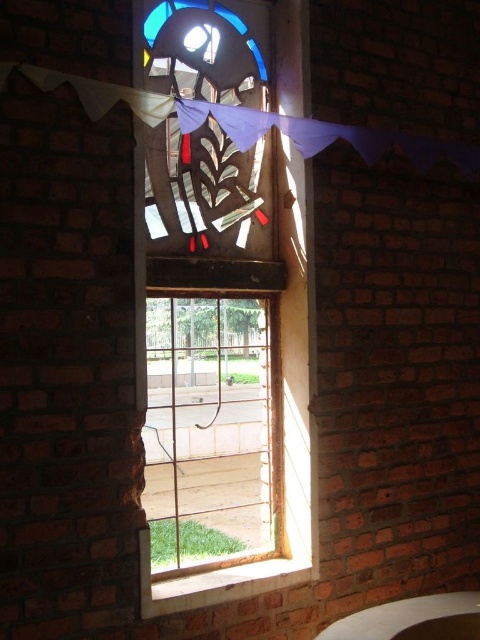
Question: Is stained glass window at center positioned in front of clear glass window at center?

Choices:
 (A) no
 (B) yes

Answer: (B)

Question: Which point is closer to the camera?

Choices:
 (A) (248, 504)
 (B) (210, 554)

Answer: (A)

Question: Among these objects, which one is farthest from the camera?

Choices:
 (A) stained glass window at center
 (B) clear glass window at center

Answer: (B)

Question: Can you confirm if stained glass window at center is thinner than clear glass window at center?

Choices:
 (A) yes
 (B) no

Answer: (B)

Question: Is stained glass window at center behind clear glass window at center?

Choices:
 (A) no
 (B) yes

Answer: (A)